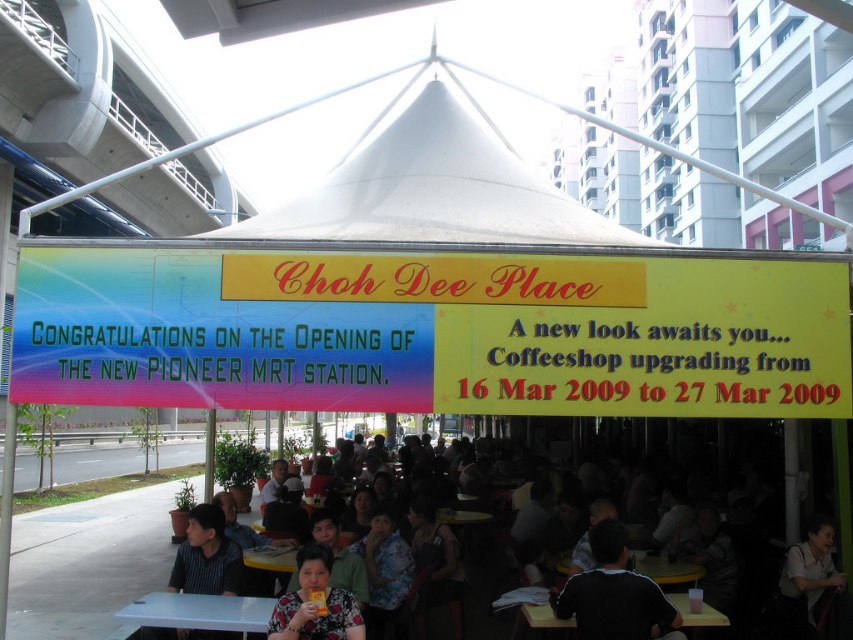
Between point (282, 630) and point (659, 577), which one is positioned behind?

Point (659, 577)

Does floral fabric shirt at lower center appear on the right side of yellow plastic table at lower center?

In fact, floral fabric shirt at lower center is to the left of yellow plastic table at lower center.

Is point (326, 616) positioned in front of point (567, 568)?

Yes, point (326, 616) is in front of point (567, 568).

Find the location of a particular element. This screenshot has width=853, height=640. floral fabric shirt at lower center is located at coordinates tap(315, 604).

Find the location of a particular element. This screenshot has width=853, height=640. floral shirt at lower center is located at coordinates (751, 556).

Who is higher up, floral shirt at lower center or floral fabric shirt at center?

floral fabric shirt at center is above.

Which is in front, point (715, 573) or point (372, 580)?

Point (372, 580) is more forward.

Find the location of a particular element. The width and height of the screenshot is (853, 640). floral shirt at lower center is located at coordinates (751, 556).

Who is lower down, light beige shirt at lower right or yellow plastic table at lower center?

yellow plastic table at lower center is lower down.

Is light beige shirt at lower right taller than yellow plastic table at lower center?

Yes.

Which is behind, point (819, 573) or point (656, 577)?

Point (656, 577)

In order to click on light beige shirt at lower right in this screenshot , I will do `click(805, 579)`.